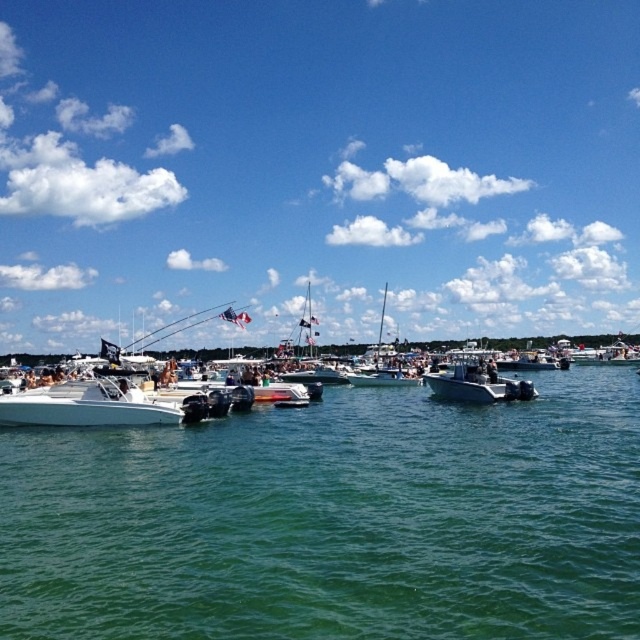
Question: Which object appears farthest from the camera in this image?

Choices:
 (A) white glossy sailboat at center
 (B) white matte sailboat at center
 (C) white glossy motorboat at center
 (D) green smooth water at center

Answer: (B)

Question: Which of the following is the closest to the observer?

Choices:
 (A) (102, 419)
 (B) (74, 8)
 (C) (634, 630)
 (D) (387, 360)

Answer: (C)

Question: Which of the following is the closest to the observer?

Choices:
 (A) white matte sailboat at center
 (B) green smooth water at center
 (C) white glossy motorboat at center
 (D) white glossy sailboat at center

Answer: (B)

Question: Does transparent blue sky at upper center appear on the left side of green smooth water at center?

Choices:
 (A) no
 (B) yes

Answer: (B)

Question: Is transparent blue sky at upper center thinner than white matte sailboat at center?

Choices:
 (A) yes
 (B) no

Answer: (B)

Question: Does white glossy motorboat at center lie in front of white matte sailboat at center?

Choices:
 (A) yes
 (B) no

Answer: (A)